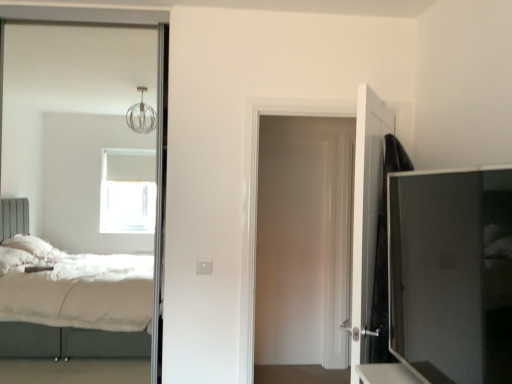
Question: From a real-world perspective, is white glossy door at center, positioned as the 2th door in front-to-back order, physically located above or below black matte door at right, marked as the 2th door in a back-to-front arrangement?

Choices:
 (A) above
 (B) below

Answer: (A)

Question: From the image's perspective, relative to black matte door at right, marked as the 2th door in a back-to-front arrangement, is white glossy door at center, which is counted as the first door, starting from the back, above or below?

Choices:
 (A) below
 (B) above

Answer: (B)

Question: Estimate the real-world distances between objects in this image. Which object is farther from the black matte door at right, marked as the 2th door in a back-to-front arrangement?

Choices:
 (A) matte black tv cabinet at right
 (B) white glossy door at center, positioned as the 2th door in front-to-back order

Answer: (B)

Question: Which of these objects is positioned closest to the matte black tv cabinet at right?

Choices:
 (A) white glossy door at center, which is counted as the first door, starting from the back
 (B) black matte door at right, marked as the 2th door in a back-to-front arrangement

Answer: (B)